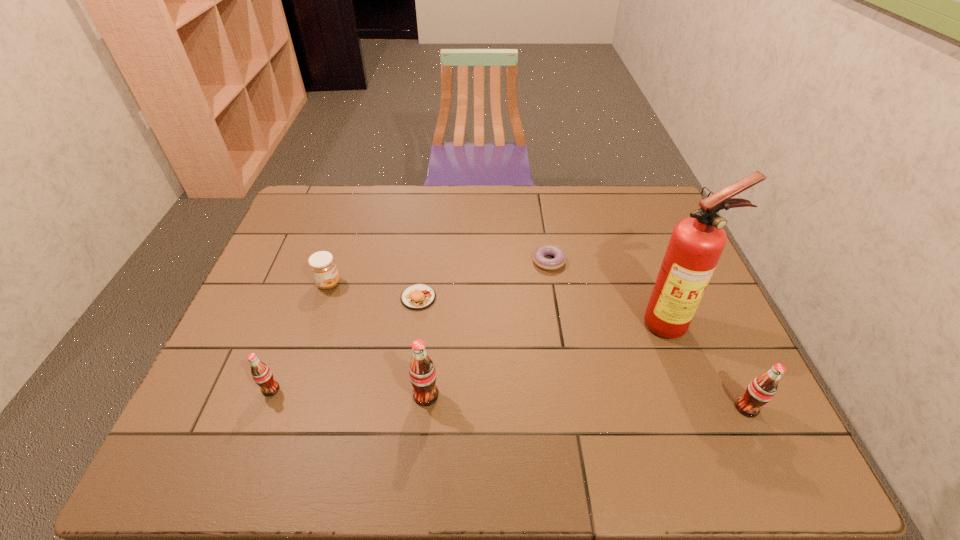
Identify the location of vacant space that is in between the shortest soda and the doughnut. The image size is (960, 540). (410, 325).

You are a GUI agent. You are given a task and a screenshot of the screen. Output one action in this format:
    pyautogui.click(x=<x>, y=<y>)
    Task: Click on the vacant area that lies between the fire extinguisher and the sixth tallest object
    
    Given the screenshot: What is the action you would take?
    pyautogui.click(x=544, y=310)

Locate an element on the screen. The image size is (960, 540). unoccupied area between the sixth tallest object and the fourth tallest object is located at coordinates pos(345,343).

Locate an element on the screen. The width and height of the screenshot is (960, 540). vacant space that's between the tallest object and the third tallest object is located at coordinates [708, 366].

Where is `empty space between the tallest object and the patty`? This screenshot has height=540, width=960. empty space between the tallest object and the patty is located at coordinates click(544, 310).

In order to click on vacant point located between the farthest object and the jam in this screenshot , I will do 439,273.

Where is `free spot between the third object from right to left and the tallest soda`? free spot between the third object from right to left and the tallest soda is located at coordinates (488, 328).

Find the location of a particular element. free space between the fourth tallest object and the sixth tallest object is located at coordinates (345, 343).

Image resolution: width=960 pixels, height=540 pixels. I want to click on the fifth closest object relative to the rightmost soda, so click(322, 264).

This screenshot has width=960, height=540. What are the coordinates of `the third closest object relative to the second tallest soda` in the screenshot? It's located at (422, 373).